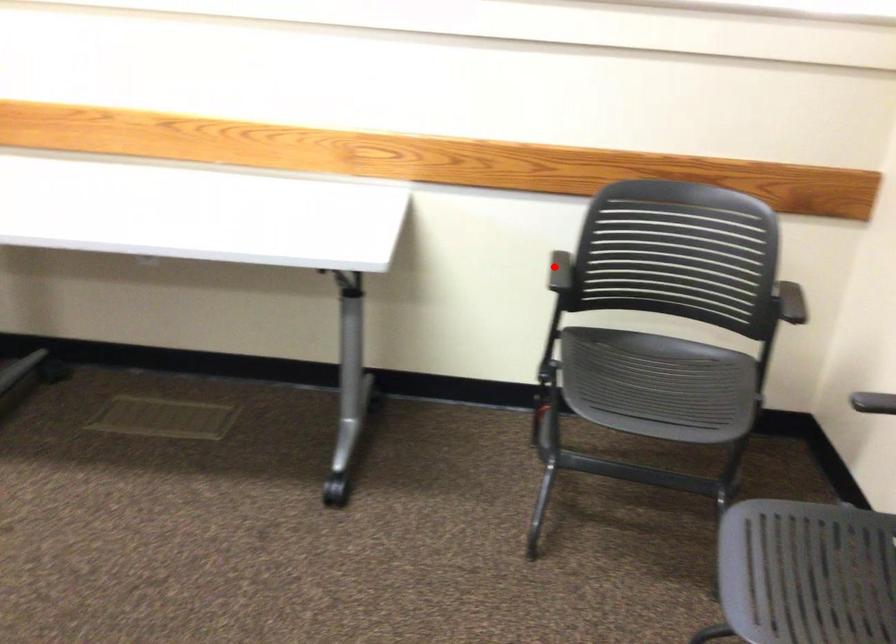
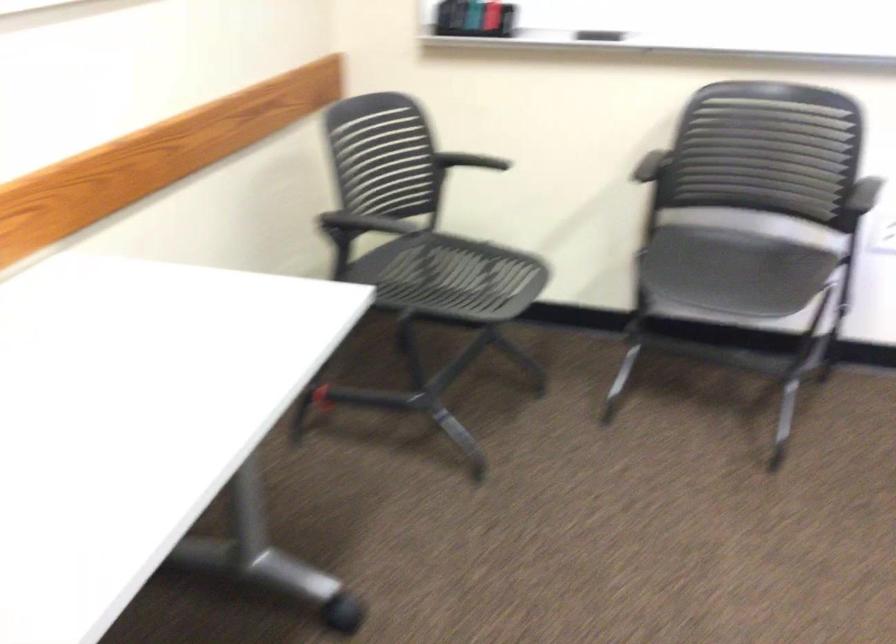
Where in the second image is the point corresponding to the highlighted location from the first image?

(364, 223)